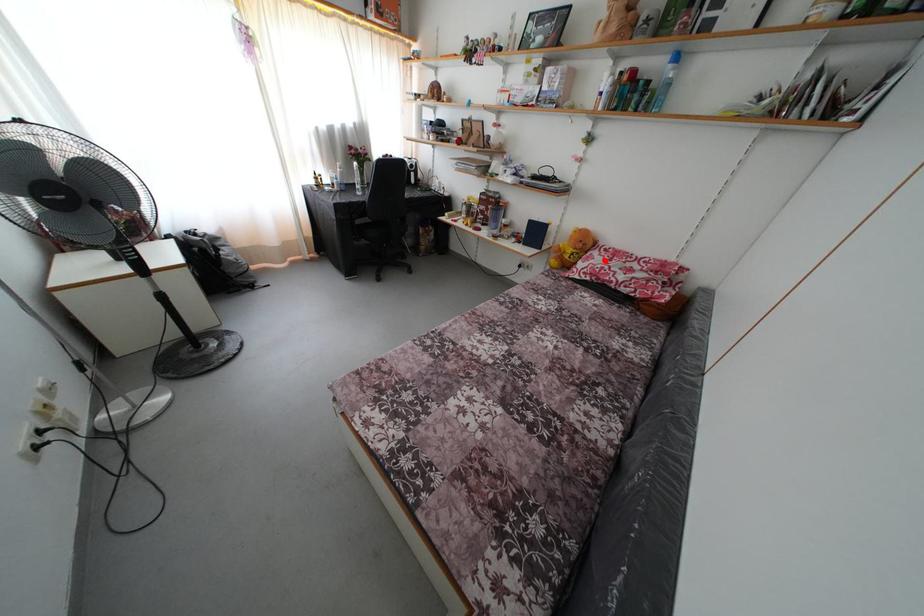
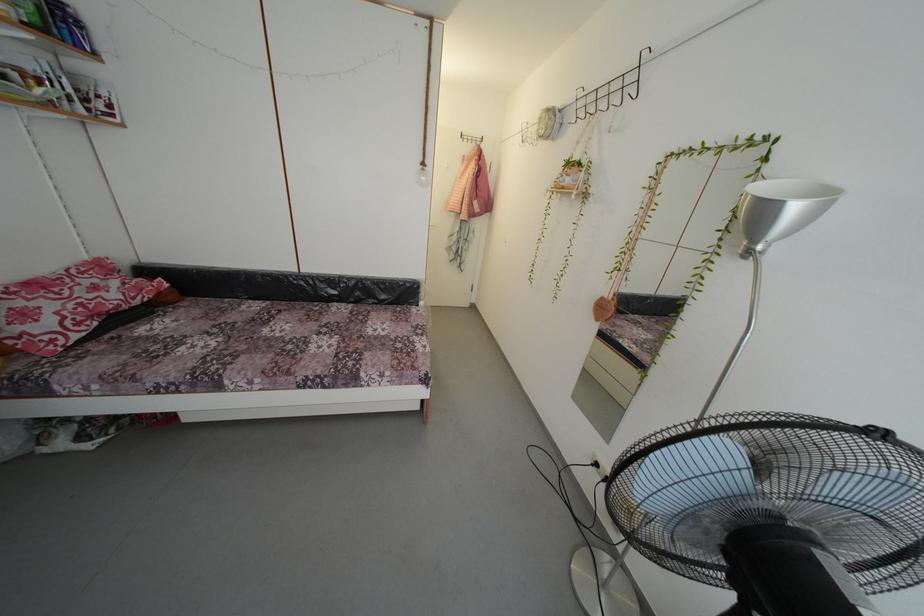
Question: I am providing you with two images of the same scene from different viewpoints. Image1 has a red point marked. In image2, the corresponding 3D location appears at what relative position? Reply with the corresponding letter.

Choices:
 (A) Closer
 (B) Farther

Answer: (B)